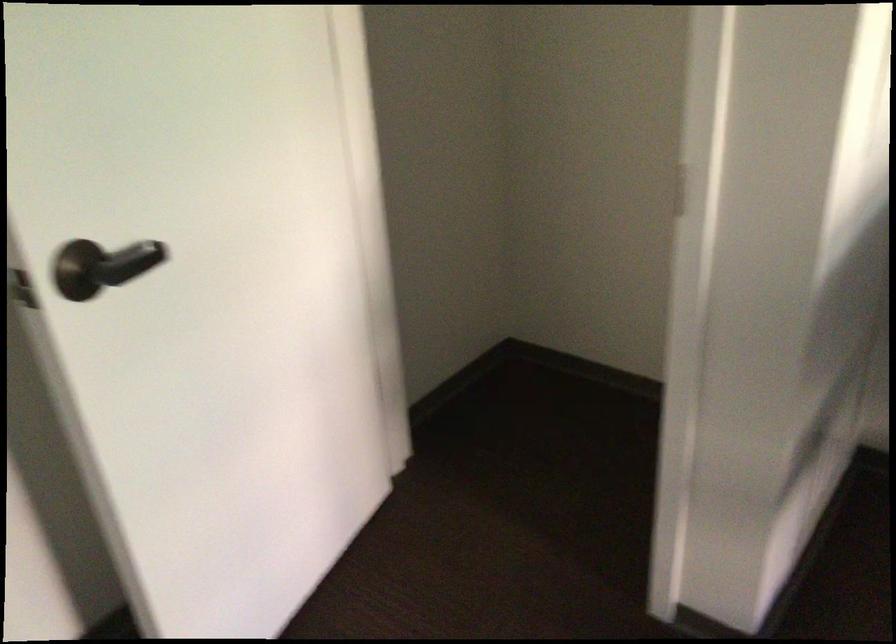
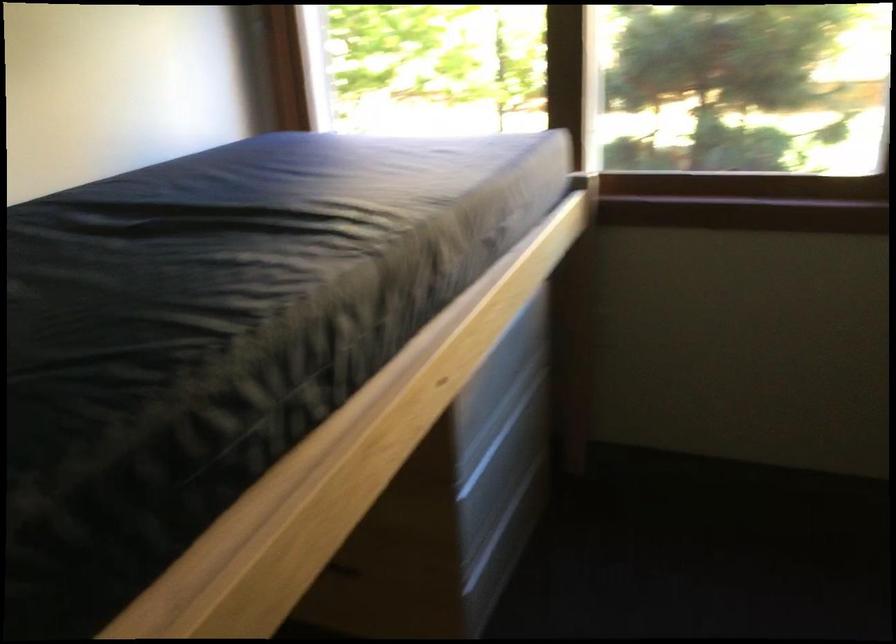
The first image is from the beginning of the video and the second image is from the end. How did the camera likely rotate when shooting the video?

The camera rotated toward right-down.